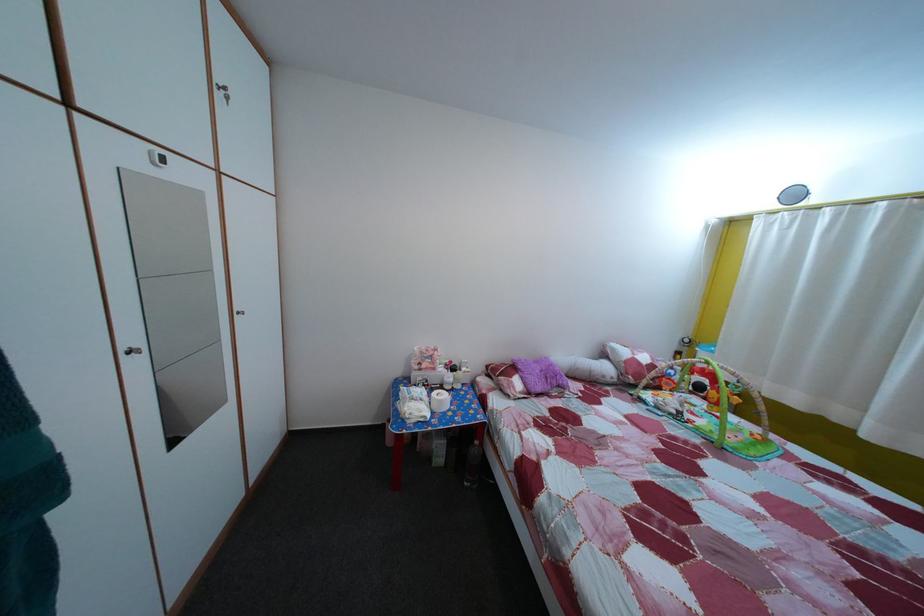
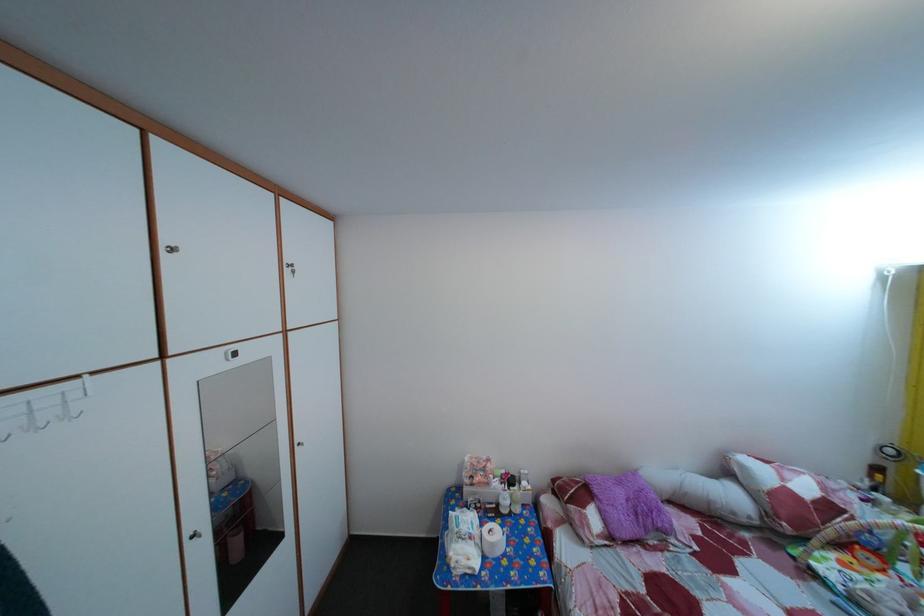
Where in the second image is the point corresponding to (237,105) from the first image?

(304, 280)